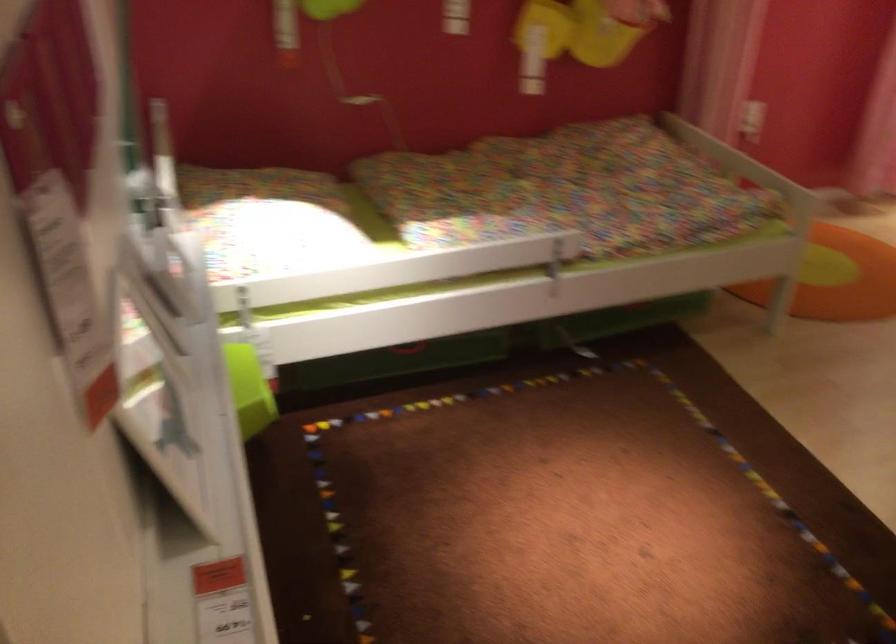
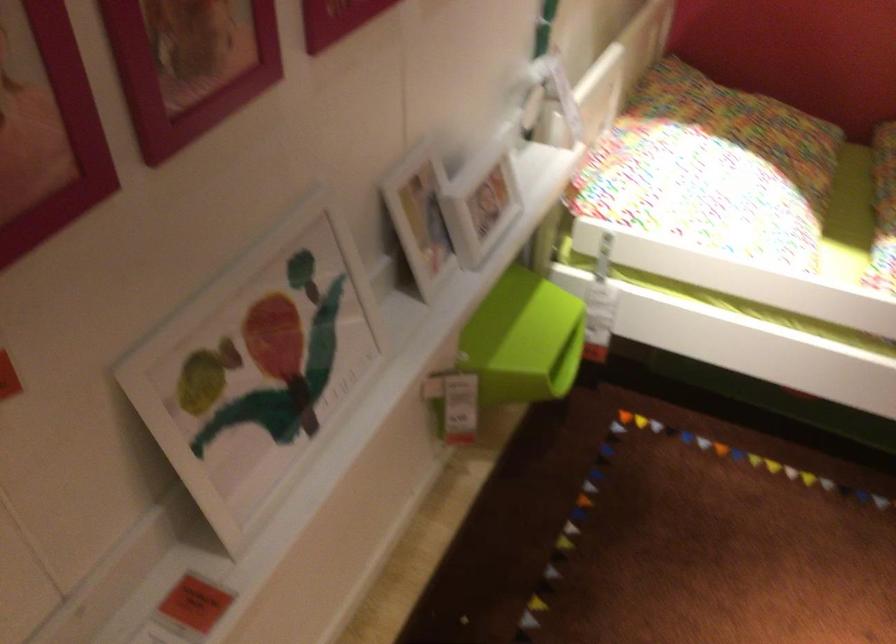
Where in the second image is the point corresponding to point 160,399 from the first image?

(257, 368)